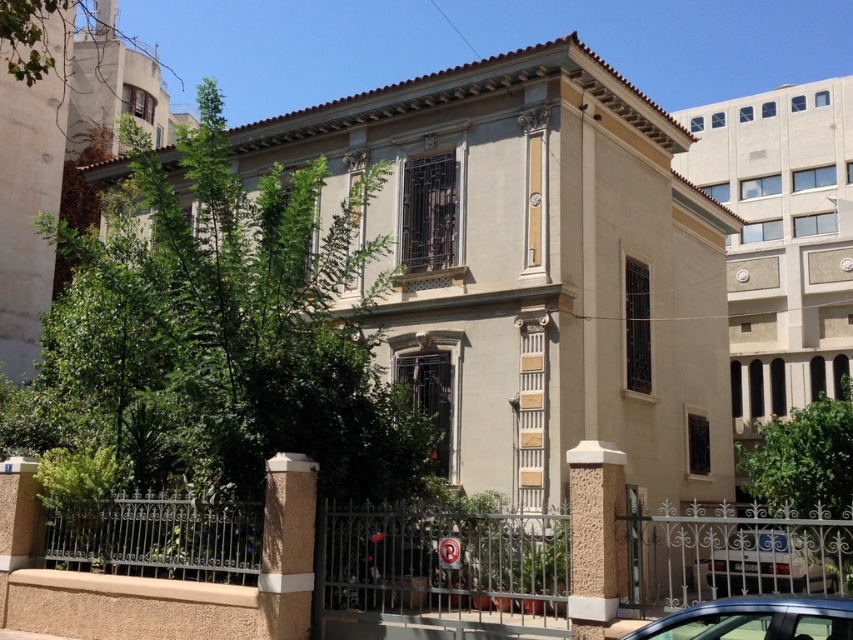
You are standing in front of the residential building and want to locate two specific points marked on the ground. The first point is at coordinates point (775,602), and the second is at point (724,563). Based on the scene description, which of these two points is closer to the entrance of the building?

Point (775,602) is in front of point (724,563), so it is closer to the entrance of the building.

You are standing in front of the building and see the point marked at coordinate (755, 620). What object is located at that point?

The point at coordinate (755, 620) indicates a metallic blue car at lower right.

You are a delivery person trying to park your white glossy car at lower right near the entrance of the building. However, there is a black wrought iron fence at lower center blocking the path. Can you drive your car through the gap between the fence and the building? Please explain your reasoning.

The black wrought iron fence at lower center is much taller than the white glossy car at lower right. Since the fence is taller, it likely extends above the car, meaning the gap between the fence and the building might be too narrow or obstructed by the fence structure for the car to pass through safely.